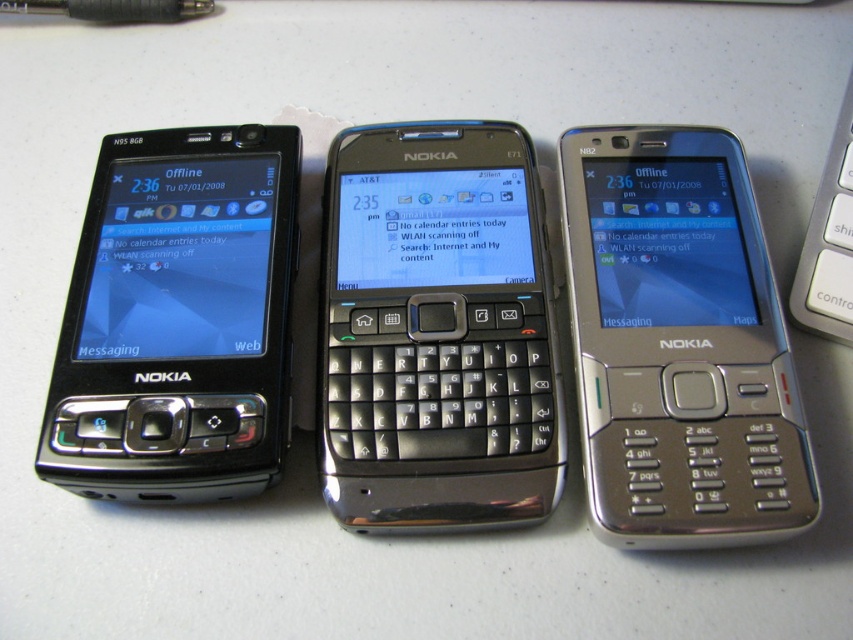
I want to click on satin black phone at center, so [436, 332].

Between point (401, 212) and point (172, 172), which one is positioned behind?

Positioned behind is point (401, 212).

What do you see at coordinates (436, 332) in the screenshot?
I see `satin black phone at center` at bounding box center [436, 332].

The image size is (853, 640). What are the coordinates of `satin black phone at center` in the screenshot? It's located at (436, 332).

How distant is satin black phone at center from silver metallic nokia phone at right?

satin black phone at center is 7.16 inches away from silver metallic nokia phone at right.

Is satin black phone at center thinner than silver metallic nokia phone at right?

Incorrect, satin black phone at center's width is not less than silver metallic nokia phone at right's.

Locate an element on the screen. Image resolution: width=853 pixels, height=640 pixels. satin black phone at center is located at coordinates (436, 332).

Can you confirm if silver metallic nokia phone at right is wider than silver metallic keyboard at right?

Yes.

Is silver metallic nokia phone at right thinner than silver metallic keyboard at right?

In fact, silver metallic nokia phone at right might be wider than silver metallic keyboard at right.

The width and height of the screenshot is (853, 640). Identify the location of silver metallic nokia phone at right. (679, 342).